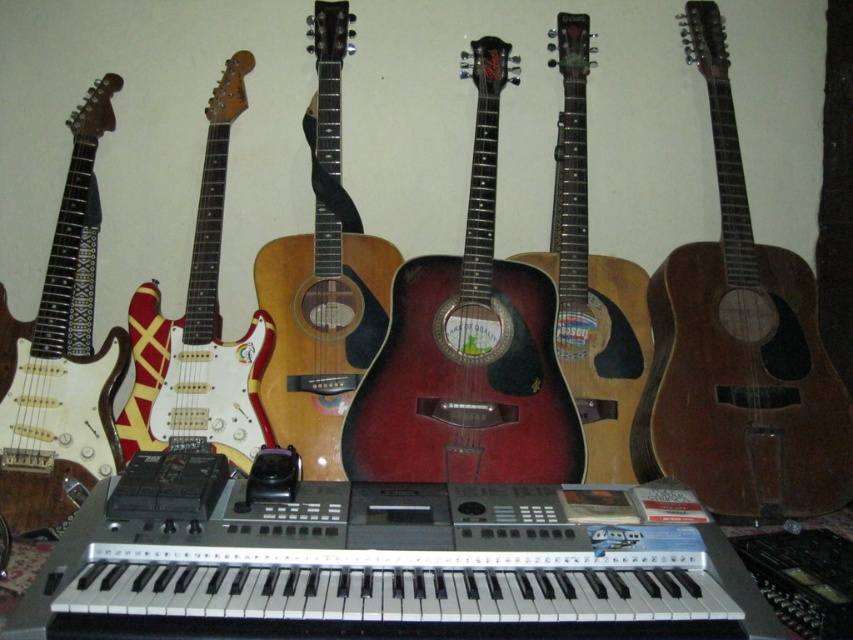
Question: Is matte dark red acoustic guitar at center below white glossy electric guitar at center-left?

Choices:
 (A) no
 (B) yes

Answer: (B)

Question: Can you confirm if brown wooden guitar at right is thinner than white glossy electric guitar at center-left?

Choices:
 (A) yes
 (B) no

Answer: (B)

Question: Which is nearer to the matte dark red acoustic guitar at center?

Choices:
 (A) white glossy electric guitar at left
 (B) brown wooden guitar at right
 (C) matte red acoustic guitar at center

Answer: (C)

Question: Which object appears farthest from the camera in this image?

Choices:
 (A) matte dark red acoustic guitar at center
 (B) brown wooden guitar at right

Answer: (B)

Question: Is brown wooden guitar at right closer to the viewer compared to matte red acoustic guitar at center?

Choices:
 (A) yes
 (B) no

Answer: (B)

Question: Which object appears closest to the camera in this image?

Choices:
 (A) white glossy electric guitar at center-left
 (B) matte red acoustic guitar at center
 (C) brown wooden guitar at right
 (D) matte dark red acoustic guitar at center

Answer: (D)